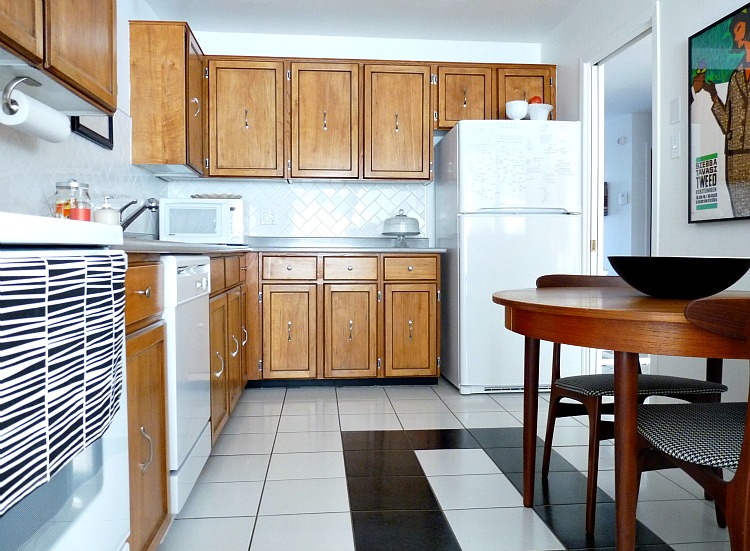
Locate an element on the screen. This screenshot has height=551, width=750. table is located at coordinates (650, 324).